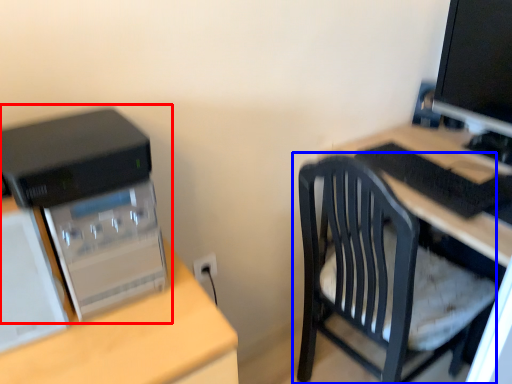
Question: Which object is closer to the camera taking this photo, computer tower (highlighted by a red box) or chair (highlighted by a blue box)?

Choices:
 (A) computer tower
 (B) chair

Answer: (A)